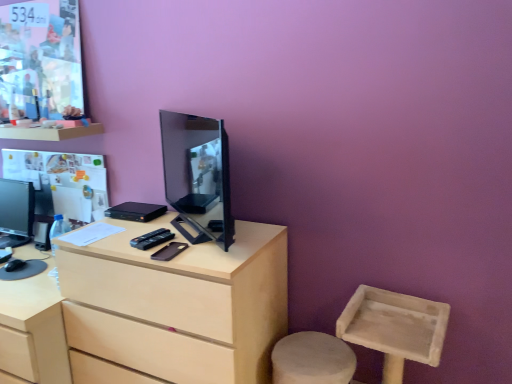
Question: In the image, is matte paper poster at upper left positioned in front of or behind black plastic remote control at center?

Choices:
 (A) front
 (B) behind

Answer: (B)

Question: From a real-world perspective, is matte paper poster at upper left positioned above or below black plastic remote control at center?

Choices:
 (A) below
 (B) above

Answer: (B)

Question: Which object is the farthest from the black matte mobile phone at center?

Choices:
 (A) matte black monitor at left, which is the second television in front-to-back order
 (B) matte black tv at center, which is the first television in right-to-left order
 (C) matte paper poster at upper left
 (D) black plastic remote control at center
 (E) light wood desk at center

Answer: (A)

Question: Estimate the real-world distances between objects in this image. Which object is closer to the matte paper poster at upper left?

Choices:
 (A) matte black tv at center, marked as the second television in a back-to-front arrangement
 (B) black plastic remote control at center
 (C) black matte mobile phone at center
 (D) matte black monitor at left, arranged as the 2th television when viewed from the right
 (E) light wood desk at center

Answer: (D)